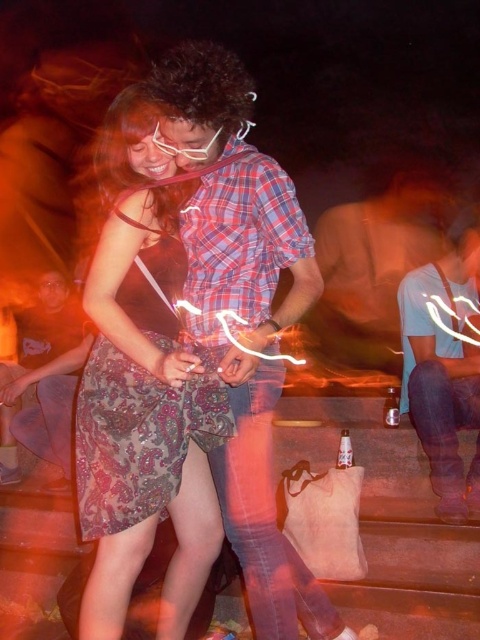
Question: From the image, what is the correct spatial relationship of patterned fabric dress at center in relation to brushed metal water at bottle left?

Choices:
 (A) right
 (B) left

Answer: (A)

Question: Which object is farther from the camera taking this photo?

Choices:
 (A) patterned fabric dress at center
 (B) brushed metal water at bottle left
 (C) blue denim jeans at lower right
 (D) plaid shirt at center

Answer: (B)

Question: Which object is positioned closest to the blue denim jeans at lower right?

Choices:
 (A) brushed metal water at bottle left
 (B) patterned fabric dress at center

Answer: (B)

Question: Does plaid shirt at center appear under patterned fabric dress at center?

Choices:
 (A) yes
 (B) no

Answer: (A)

Question: Among these objects, which one is farthest from the camera?

Choices:
 (A) plaid shirt at center
 (B) patterned fabric dress at center
 (C) blue denim jeans at lower right
 (D) brushed metal water at bottle left

Answer: (D)

Question: Is patterned fabric dress at center wider than brushed metal water at bottle left?

Choices:
 (A) no
 (B) yes

Answer: (A)